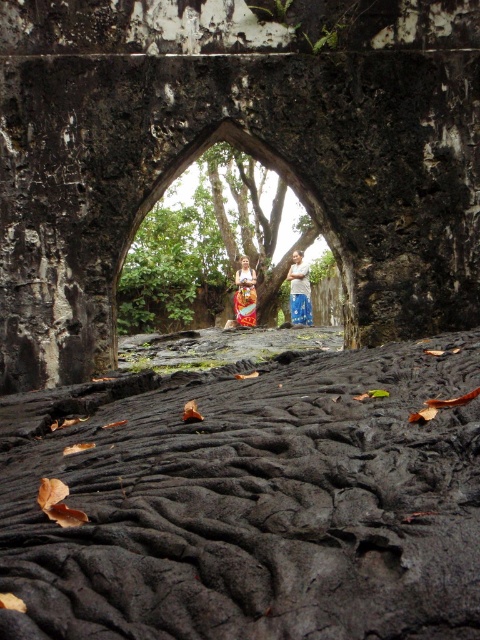
Measure the distance from blue denim jeans at center to orange fabric skirt at center.

1.23 meters

The height and width of the screenshot is (640, 480). What do you see at coordinates (300, 291) in the screenshot? I see `blue denim jeans at center` at bounding box center [300, 291].

Does point (299, 272) lie in front of point (242, 296)?

That is True.

This screenshot has width=480, height=640. Identify the location of blue denim jeans at center. (300, 291).

How far apart are green leafy tree at center and blue denim jeans at center?

green leafy tree at center and blue denim jeans at center are 4.92 meters apart.

Is green leafy tree at center bigger than blue denim jeans at center?

Correct, green leafy tree at center is larger in size than blue denim jeans at center.

Does point (166, 260) come in front of point (295, 310)?

That is False.

At what (x,y) coordinates should I click in order to perform the action: click on green leafy tree at center. Please return your answer as a coordinate pair (x, y). Image resolution: width=480 pixels, height=640 pixels. Looking at the image, I should click on (205, 246).

Does black textured rock at lower center have a greater height compared to blue denim jeans at center?

In fact, black textured rock at lower center may be shorter than blue denim jeans at center.

Who is more distant from viewer, (x=459, y=474) or (x=298, y=298)?

Point (x=298, y=298)

Measure the distance between point [296,422] and camera.

The distance of point [296,422] from camera is 2.42 meters.

At what (x,y) coordinates should I click in order to perform the action: click on black textured rock at lower center. Please return your answer as a coordinate pair (x, y). Looking at the image, I should click on (250, 500).